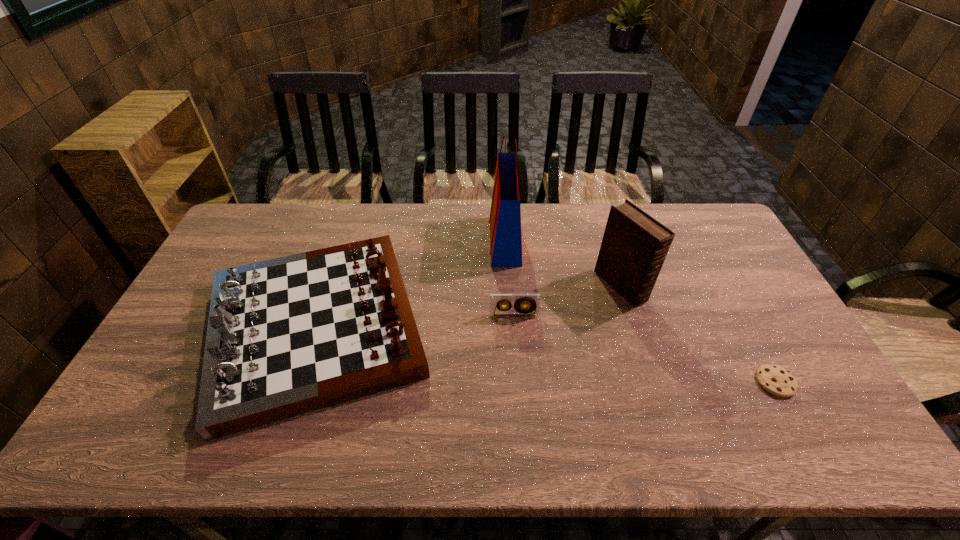
Locate an element on the screen. The image size is (960, 540). vacant space that satisfies the following two spatial constraints: 1. on the front side of the leftmost object; 2. on the left side of the cookie is located at coordinates (299, 382).

Identify the location of vacant region that satisfies the following two spatial constraints: 1. at the front of the cookie with visible reels; 2. on the right side of the videotape. pyautogui.click(x=518, y=382).

The image size is (960, 540). Identify the location of free space that satisfies the following two spatial constraints: 1. on the handle side of the shopping bag; 2. on the right side of the rightmost object. (514, 382).

The width and height of the screenshot is (960, 540). Identify the location of vacant area that satisfies the following two spatial constraints: 1. on the back side of the Bible; 2. on the handle side of the tallest object. (607, 241).

Find the location of a particular element. free space that satisfies the following two spatial constraints: 1. on the handle side of the tallest object; 2. on the left side of the fourth shortest object is located at coordinates (508, 286).